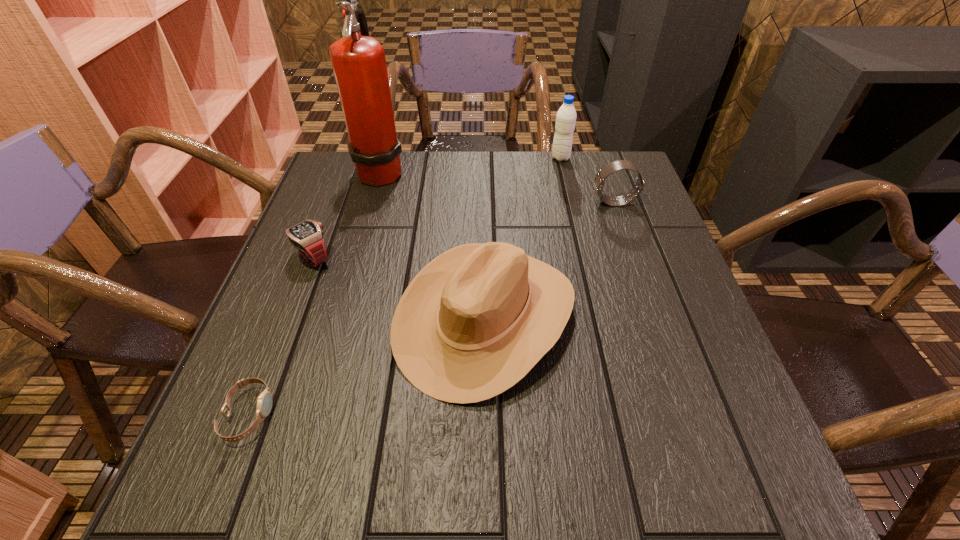
At what (x,y) coordinates should I click in order to perform the action: click on vacant space that's between the fifth shortest object and the tallest watch. Please return your answer as a coordinate pair (x, y). Image resolution: width=960 pixels, height=540 pixels. Looking at the image, I should click on (588, 180).

Where is `vacant point located between the second shortest object and the fire extinguisher`? This screenshot has width=960, height=540. vacant point located between the second shortest object and the fire extinguisher is located at coordinates (347, 214).

At what (x,y) coordinates should I click in order to perform the action: click on object that is the fourth closest to the cowboy hat. Please return your answer as a coordinate pair (x, y). Looking at the image, I should click on (359, 64).

This screenshot has width=960, height=540. Identify the location of object that ranks as the fourth closest to the water bottle. (307, 236).

Select which watch appears as the closest to the rightmost object. Please provide its 2D coordinates. Your answer should be formatted as a tuple, i.e. [(x, y)], where the tuple contains the x and y coordinates of a point satisfying the conditions above.

[(307, 236)]

This screenshot has width=960, height=540. Find the location of `watch that is the closest to the tallest object`. watch that is the closest to the tallest object is located at coordinates (307, 236).

At what (x,y) coordinates should I click in order to perform the action: click on vacant space that satisfies the following two spatial constraints: 1. on the face of the farthest watch; 2. on the front side of the fourth shortest object. Please return your answer as a coordinate pair (x, y). Looking at the image, I should click on (654, 316).

The image size is (960, 540). What are the coordinates of `vacant space that satisfies the following two spatial constraints: 1. at the nozzle of the fire extinguisher; 2. on the back side of the third object from right to left` in the screenshot? It's located at (340, 316).

The height and width of the screenshot is (540, 960). I want to click on vacant region that satisfies the following two spatial constraints: 1. on the front side of the cowboy hat; 2. on the left side of the second shortest object, so click(291, 316).